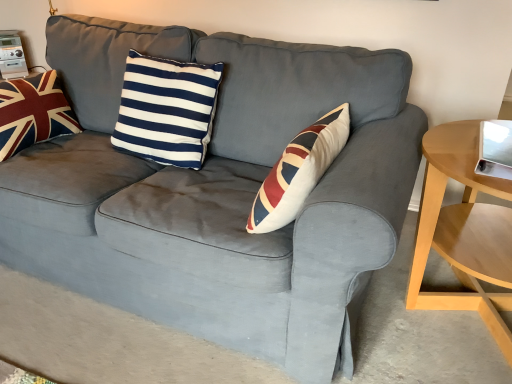
In order to click on free point below light wood/woodenobject at right (from a real-world perspective) in this screenshot , I will do `click(453, 321)`.